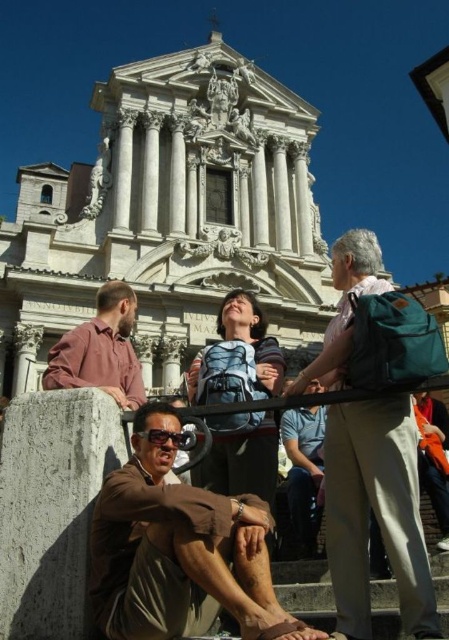
Question: Considering the real-world distances, which object is closest to the blue backpack at center?

Choices:
 (A) black plastic goggles at lower center
 (B) brown cotton shirt at lower center
 (C) orange fabric at lower right
 (D) matte brown shirt at center

Answer: (B)

Question: Which of the following is the farthest from the observer?

Choices:
 (A) brown cotton shirt at lower center
 (B) matte brown shirt at center

Answer: (B)

Question: Is brown cotton shirt at lower center closer to camera compared to orange fabric at lower right?

Choices:
 (A) no
 (B) yes

Answer: (B)

Question: Is blue backpack at center further to the viewer compared to black plastic goggles at lower center?

Choices:
 (A) yes
 (B) no

Answer: (B)

Question: Which point is farther to the camera?

Choices:
 (A) green fabric backpack at right
 (B) blue backpack at center
 (C) matte brown shirt at center
 (D) black plastic goggles at lower center

Answer: (C)

Question: Does matte brown shirt at center have a lesser width compared to black plastic goggles at lower center?

Choices:
 (A) no
 (B) yes

Answer: (A)